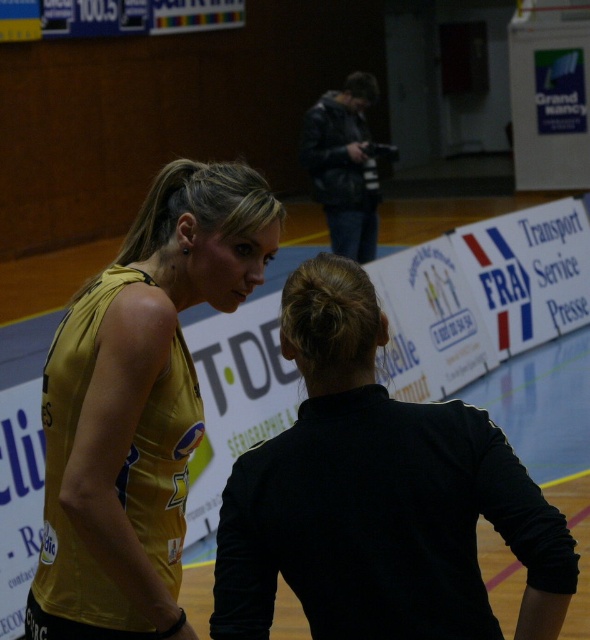
Who is more distant from viewer, (163,339) or (348,145)?

The point (348,145) is behind.

Does gold jersey at left have a greater width compared to dark gray leather jacket at upper center?

Yes, gold jersey at left is wider than dark gray leather jacket at upper center.

Where is `gold jersey at left`? Image resolution: width=590 pixels, height=640 pixels. gold jersey at left is located at coordinates (139, 404).